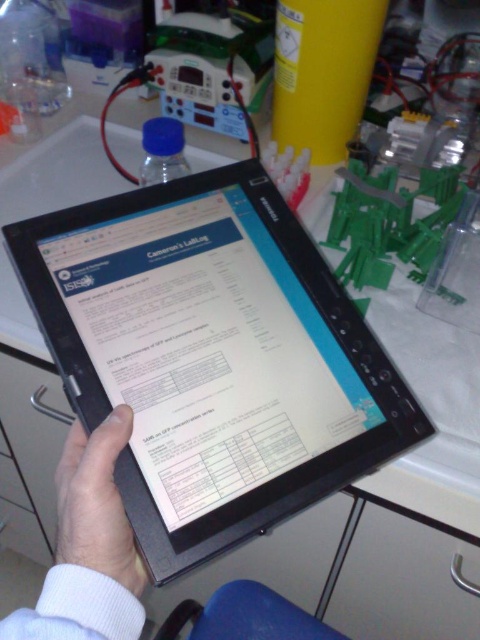
You are a researcher in the lab and need to place a small sensor on the table. The sensor requires a flat area that is not obstructed by any objects. Based on the image, where should you place the sensor to ensure it is on the white matte skin at center?

The sensor should be placed at the position of the white matte skin at center, which is located at coordinates point (96, 502). This area is described as flat and unobstructed according to the scene description.

You are a lab assistant who needs to reach the black plastic tablet at center on the table. The lab has safety protocols requiring you to maintain a minimum distance of 15 inches from any equipment when moving around. Can you safely approach the tablet without violating the protocol?

The black plastic tablet at center is 16.21 inches away from the camera, which is more than the required 15 inches. Therefore, you can safely approach it while adhering to the safety protocols.

You are a researcher in the lab and need to locate the black plastic tablet at center and the white matte skin at center. From the perspective of someone facing the table, which object is positioned to the left?

The white matte skin at center is positioned to the left of the black plastic tablet at center.